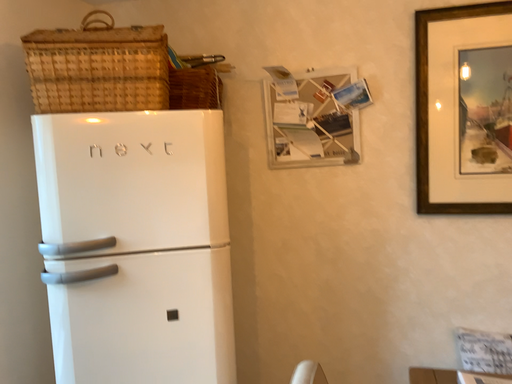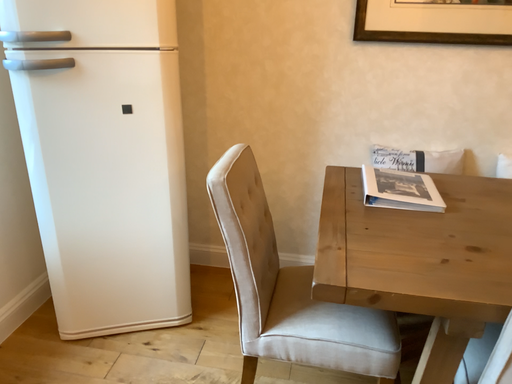
Question: Which way did the camera rotate in the video?

Choices:
 (A) rotated downward
 (B) rotated upward

Answer: (A)